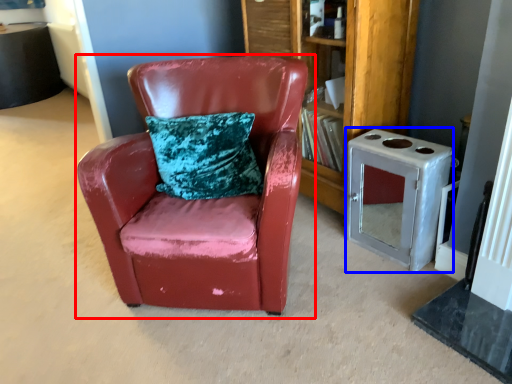
Question: Which object appears farthest to the camera in this image, chair (highlighted by a red box) or appliance (highlighted by a blue box)?

Choices:
 (A) chair
 (B) appliance

Answer: (B)